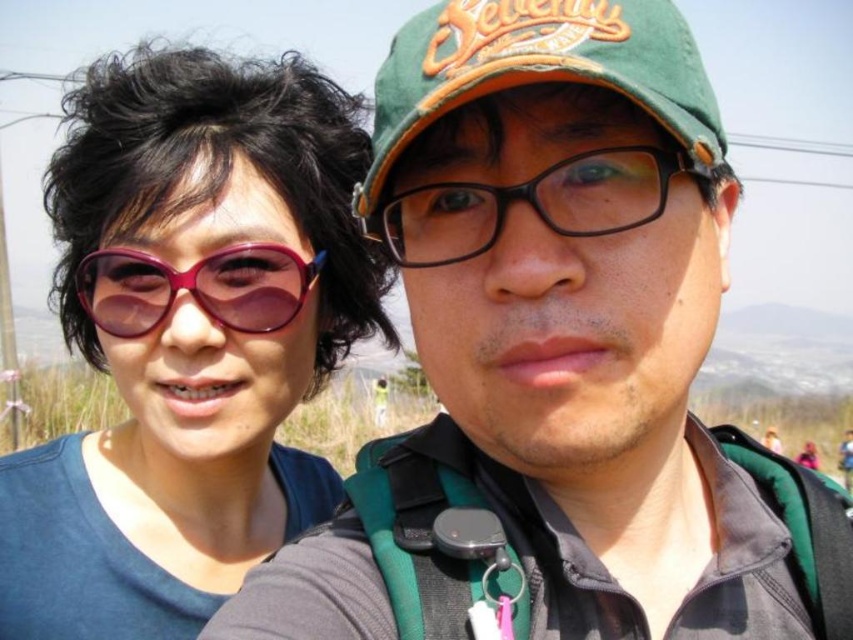
You are standing at the position of the two people in the image and want to throw a ball to a point that is exactly 6 feet away from you. Is the point at coordinate point (219, 456) within the target range?

The distance of point (219, 456) from camera is 6.24 feet, so the point is slightly beyond the 6 feet target range.

You are a photographer trying to capture a closeup of the matte purple sunglasses at upper left and the green fabric baseball cap at upper center. Which object should you focus on first if you want to ensure both are in focus without moving the camera?

The matte purple sunglasses at upper left is below the green fabric baseball cap at upper center, so you should focus on the green fabric baseball cap at upper center first since it is closer to the camera. This will ensure the matte purple sunglasses at upper left, being further away, remains in focus as well.

You are a photographer setting up a shot of the two people in the scene. You need to ensure that the matte purple sunglasses at upper left and the green fabric baseball cap at upper center are both clearly visible in the frame. Given their relative sizes in the image, which object should you focus on to ensure both are in focus?

The matte purple sunglasses at upper left has a greater height compared to the green fabric baseball cap at upper center. To ensure both are in focus, you should focus on the matte purple sunglasses at upper left since it is larger and requires more precise focus to capture details clearly.